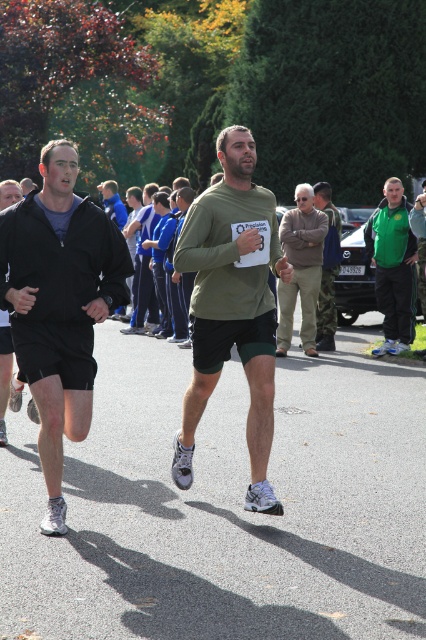
You are a race official observing the runners in the race. You notice two runners wearing the matte black jacket at left and the green matte shirt at center. Based on their positions, which runner is closer to the finish line?

The matte black jacket at left is below the green matte shirt at center, so the runner wearing the green matte shirt at center is closer to the finish line.

You are a photographer at the race. You need to capture a photo of the camouflage pants at center and the green fabric jacket at right. Based on their positions, which object will appear larger in the photo?

The green fabric jacket at right will appear larger in the photo because it is located above the camouflage pants at center, meaning it is closer to the camera.